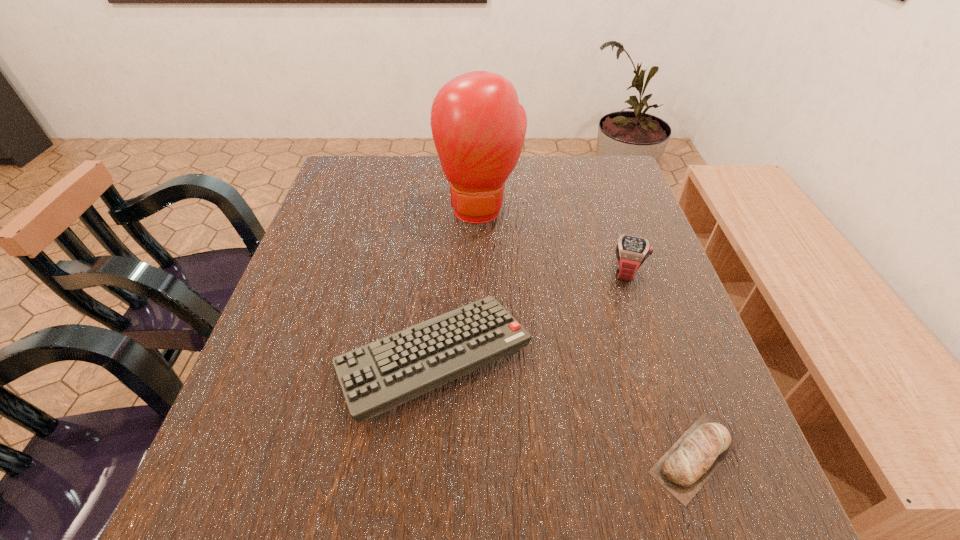
Find the location of `boxing glove`. boxing glove is located at coordinates (478, 126).

Where is `the farthest object`? the farthest object is located at coordinates (478, 126).

Find the location of `the second tallest object`. the second tallest object is located at coordinates 631,252.

The image size is (960, 540). I want to click on the second farthest object, so click(631, 252).

You are a GUI agent. You are given a task and a screenshot of the screen. Output one action in this format:
    pyautogui.click(x=<x>, y=<y>)
    Task: Click on the third tallest object
    
    Given the screenshot: What is the action you would take?
    pyautogui.click(x=376, y=377)

Where is `the shortest object`? the shortest object is located at coordinates (690, 462).

The width and height of the screenshot is (960, 540). Identify the location of vacant space situated 0.260m on the striking surface of the tallest object. (481, 313).

I want to click on vacant region located on the front of the second farthest object, so click(x=648, y=336).

You are a GUI agent. You are given a task and a screenshot of the screen. Output one action in this format:
    pyautogui.click(x=<x>, y=<y>)
    Task: Click on the vacant space situated on the front of the second shortest object
    
    Given the screenshot: What is the action you would take?
    pyautogui.click(x=423, y=461)

Locate an element on the screen. The image size is (960, 540). free space located on the back of the pita bread is located at coordinates (646, 315).